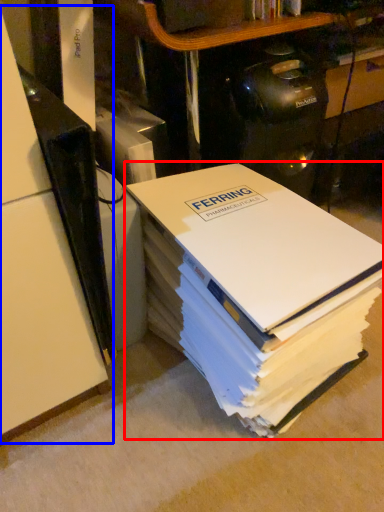
Question: Among these objects, which one is farthest to the camera, book (highlighted by a red box) or shelf (highlighted by a blue box)?

Choices:
 (A) book
 (B) shelf

Answer: (B)